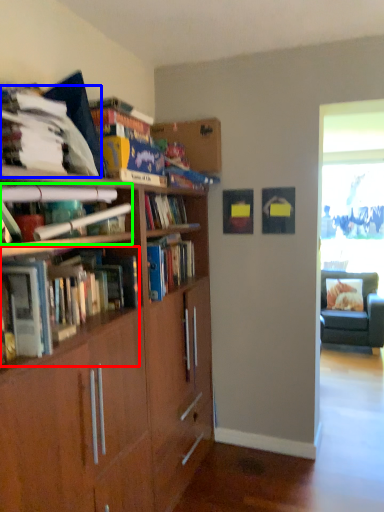
Question: Which object is positioned farthest from book (highlighted by a red box)? Select from book (highlighted by a blue box) and book (highlighted by a green box).

Choices:
 (A) book
 (B) book

Answer: (A)